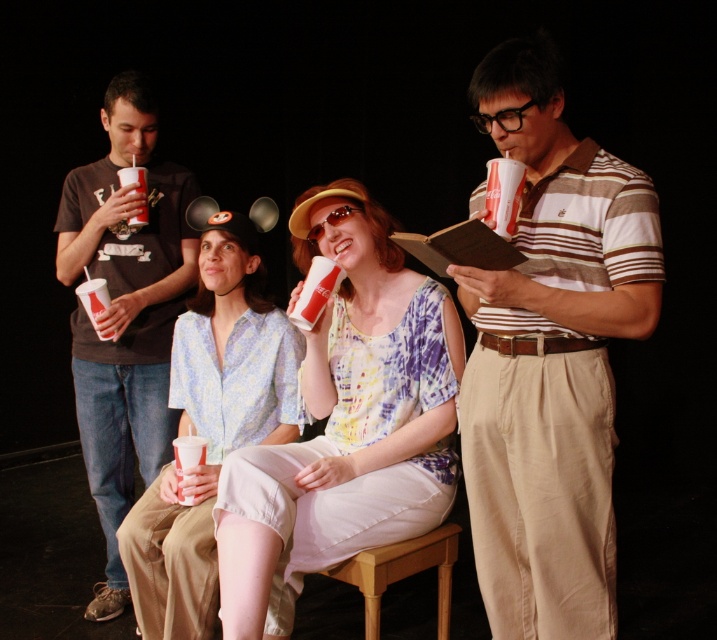
Question: Estimate the real-world distances between objects in this image. Which object is closer to the light blue floral blouse at center?

Choices:
 (A) translucent plastic cup at upper left
 (B) matte black t-shirt at left

Answer: (B)

Question: Is matte tie-dye blouse at center further to the viewer compared to matte black t-shirt at left?

Choices:
 (A) no
 (B) yes

Answer: (A)

Question: Is brown striped shirt at center positioned behind light blue floral blouse at center?

Choices:
 (A) yes
 (B) no

Answer: (B)

Question: Is matte tie-dye blouse at center wider than translucent plastic cup at left?

Choices:
 (A) no
 (B) yes

Answer: (B)

Question: Among these points, which one is farthest from the camera?

Choices:
 (A) (422, 298)
 (B) (125, 179)
 (C) (110, 330)
 (D) (503, 275)

Answer: (B)

Question: Which object is closer to the camera taking this photo?

Choices:
 (A) translucent plastic cup at upper left
 (B) brown striped shirt at center
 (C) translucent plastic cup at left
 (D) light blue floral blouse at center

Answer: (B)